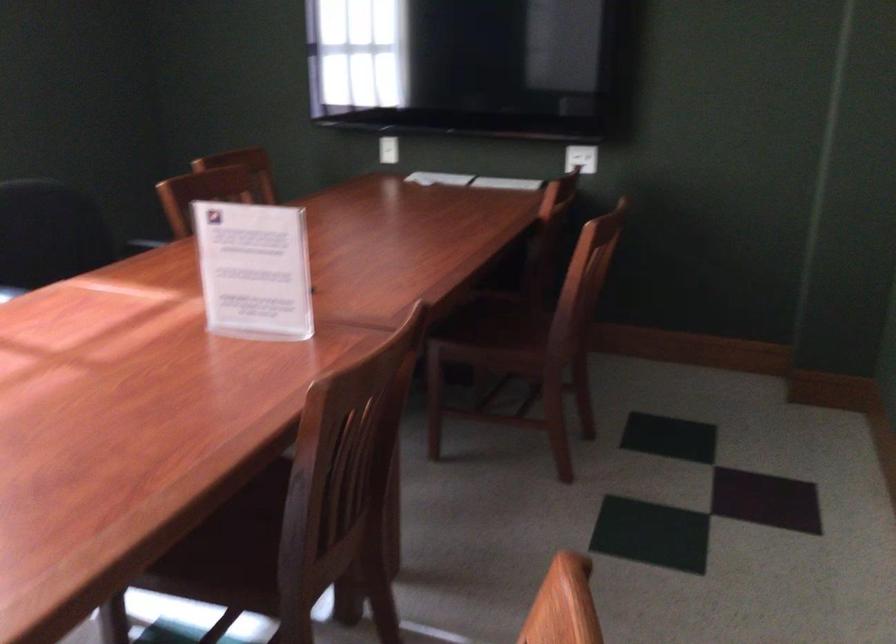
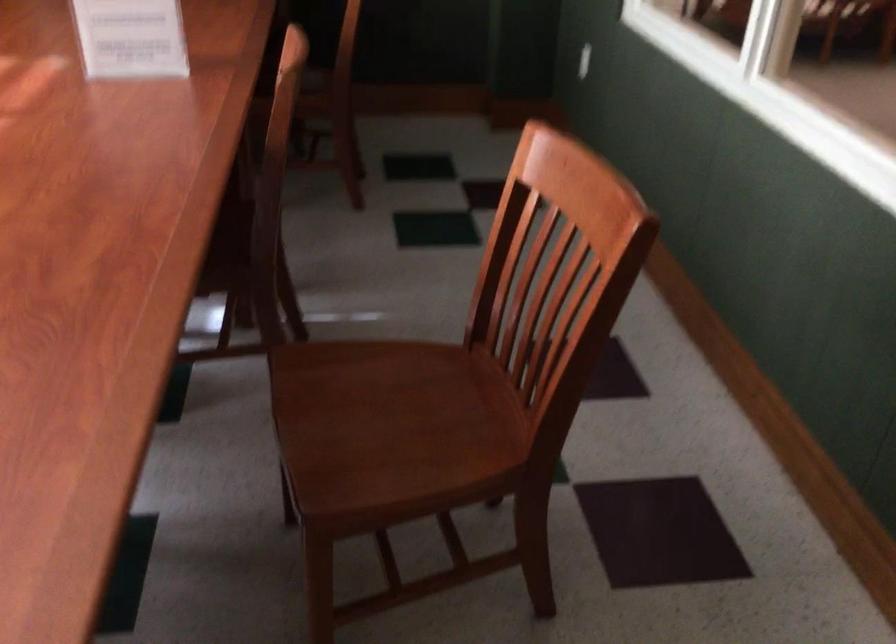
In the scene shown: Which direction would the cameraman need to move to produce the second image?

The movement direction of the cameraman is left, backward.